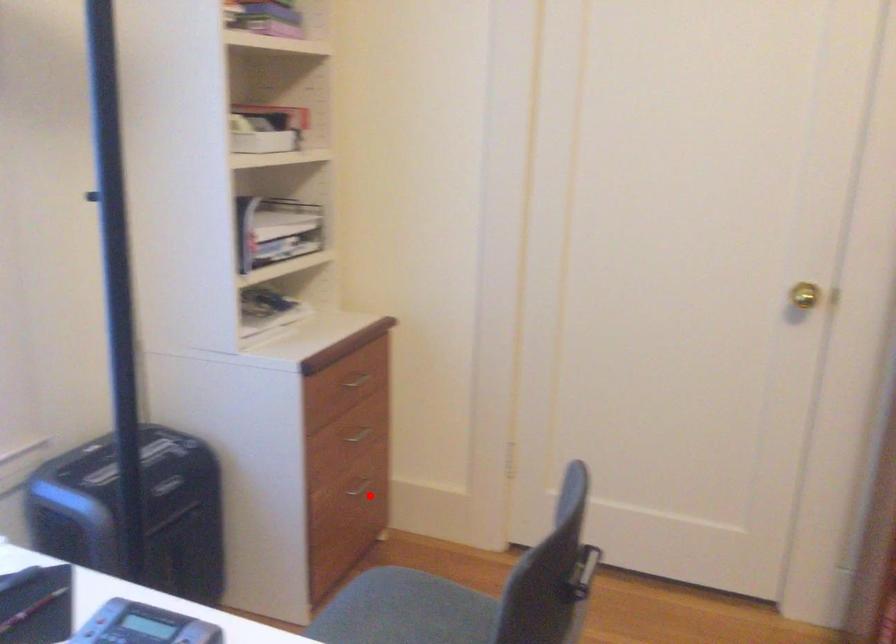
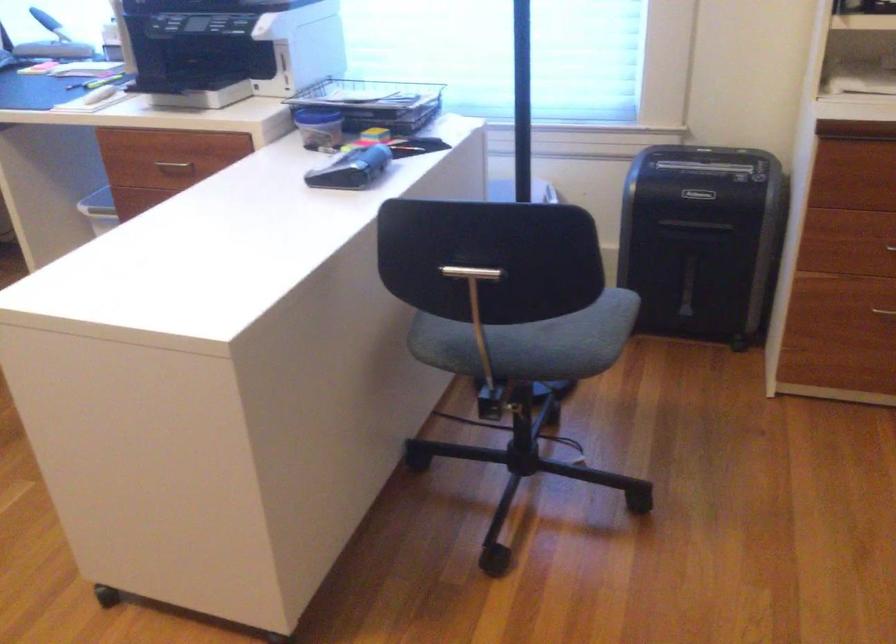
Question: I am providing you with two images of the same scene from different viewpoints. Given a red point in image1, look at the same physical point in image2. Is it:

Choices:
 (A) Closer to the viewpoint
 (B) Farther from the viewpoint

Answer: (A)